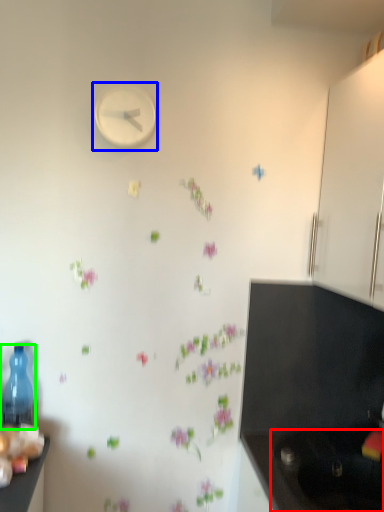
Question: Which object is the closest to the sink (highlighted by a red box)? Choose among these: clock (highlighted by a blue box) or bottle (highlighted by a green box).

Choices:
 (A) clock
 (B) bottle

Answer: (B)